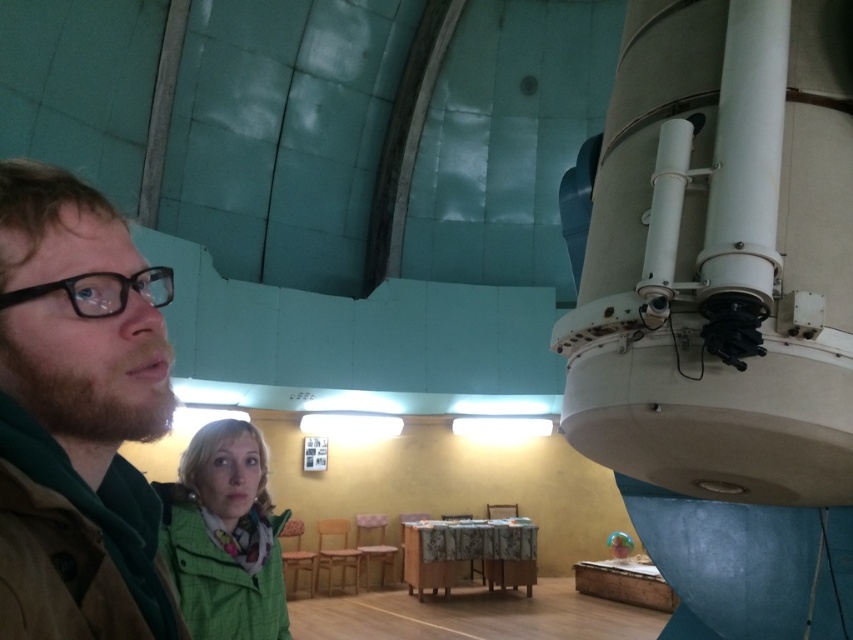
Question: Which point is farther to the camera?

Choices:
 (A) brown leather jacket at left
 (B) green fabric jacket at lower left

Answer: (B)

Question: From the image, what is the correct spatial relationship of brown leather jacket at left in relation to green fabric jacket at lower left?

Choices:
 (A) left
 (B) right

Answer: (B)

Question: Can you confirm if brown leather jacket at left is positioned below green fabric jacket at lower left?

Choices:
 (A) yes
 (B) no

Answer: (B)

Question: Which point is closer to the camera taking this photo?

Choices:
 (A) (248, 506)
 (B) (44, 323)

Answer: (B)

Question: Among these points, which one is farthest from the camera?

Choices:
 (A) (22, 492)
 (B) (238, 604)

Answer: (B)

Question: Does brown leather jacket at left appear over green fabric jacket at lower left?

Choices:
 (A) no
 (B) yes

Answer: (B)